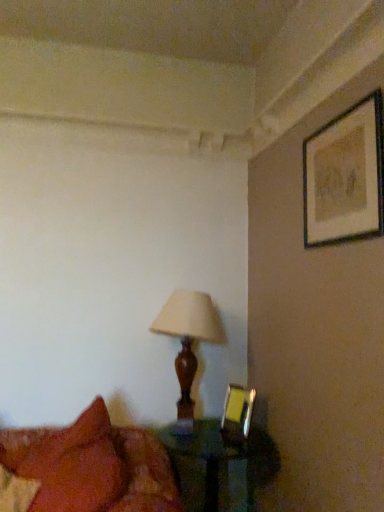
Question: From a real-world perspective, relative to translucent glass table at lower center, is wooden lampshade at center vertically above or below?

Choices:
 (A) below
 (B) above

Answer: (B)

Question: Considering the positions of wooden lampshade at center and translucent glass table at lower center in the image, is wooden lampshade at center bigger or smaller than translucent glass table at lower center?

Choices:
 (A) small
 (B) big

Answer: (A)

Question: Estimate the real-world distances between objects in this image. Which object is farther from the wooden lampshade at center?

Choices:
 (A) matte black picture frame at upper right, which is counted as the second picture frame, starting from the bottom
 (B) translucent glass table at lower center
 (C) velvet red pillow at lower left
 (D) metallic gold picture frame at lower right, placed as the first picture frame when sorted from left to right

Answer: (A)

Question: Considering the real-world distances, which object is farthest from the velvet red pillow at lower left?

Choices:
 (A) wooden lampshade at center
 (B) translucent glass table at lower center
 (C) matte black picture frame at upper right, which is the 2th picture frame in back-to-front order
 (D) metallic gold picture frame at lower right, the first picture frame positioned from the bottom

Answer: (C)